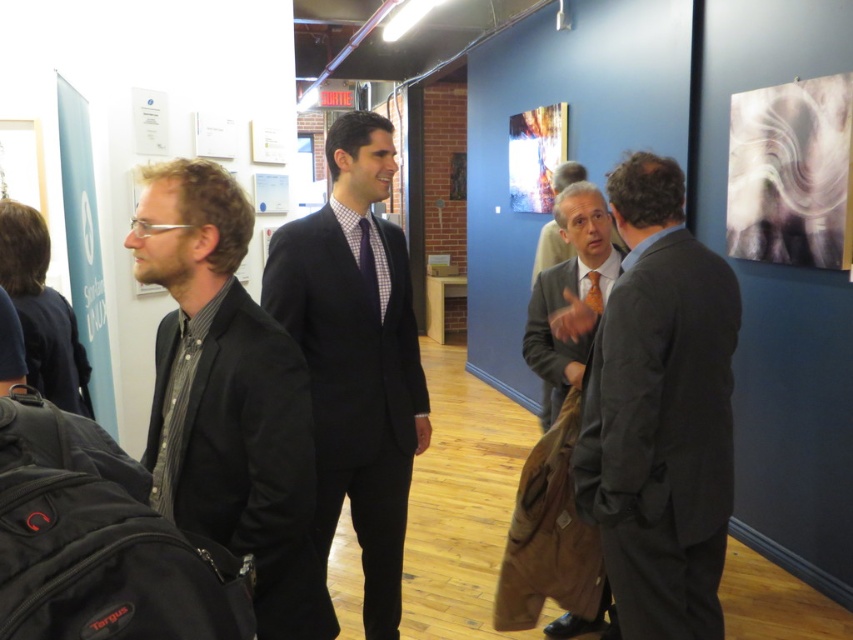
Question: From the image, what is the correct spatial relationship of black matte suit at left in relation to matte black suit at center?

Choices:
 (A) left
 (B) right

Answer: (A)

Question: Among these points, which one is farthest from the camera?

Choices:
 (A) (166, 404)
 (B) (358, 120)

Answer: (B)

Question: Is dark gray suit at center to the left of checkered fabric tie at center from the viewer's perspective?

Choices:
 (A) no
 (B) yes

Answer: (A)

Question: Observing the image, what is the correct spatial positioning of matte gray suit at center in reference to orange silk tie at center?

Choices:
 (A) above
 (B) below

Answer: (B)

Question: Estimate the real-world distances between objects in this image. Which object is closer to the dark gray suit at center?

Choices:
 (A) checkered fabric tie at center
 (B) black matte suit at left

Answer: (A)

Question: Which point is closer to the camera taking this photo?

Choices:
 (A) coord(363,260)
 (B) coord(292,320)

Answer: (B)